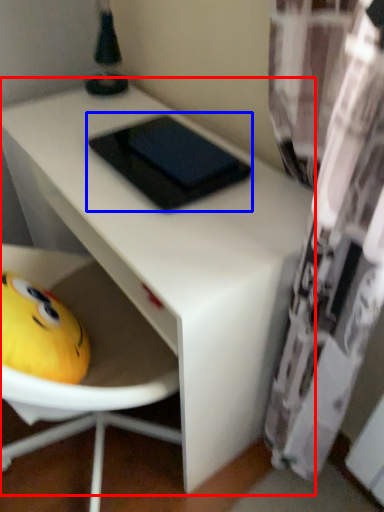
Question: Which object is further to the camera taking this photo, table (highlighted by a red box) or pad (highlighted by a blue box)?

Choices:
 (A) table
 (B) pad

Answer: (B)